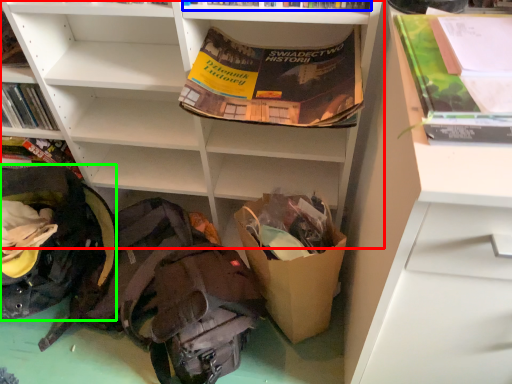
Question: Which object is the farthest from shelf (highlighted by a red box)? Choose among these: book (highlighted by a blue box) or backpack (highlighted by a green box).

Choices:
 (A) book
 (B) backpack

Answer: (A)